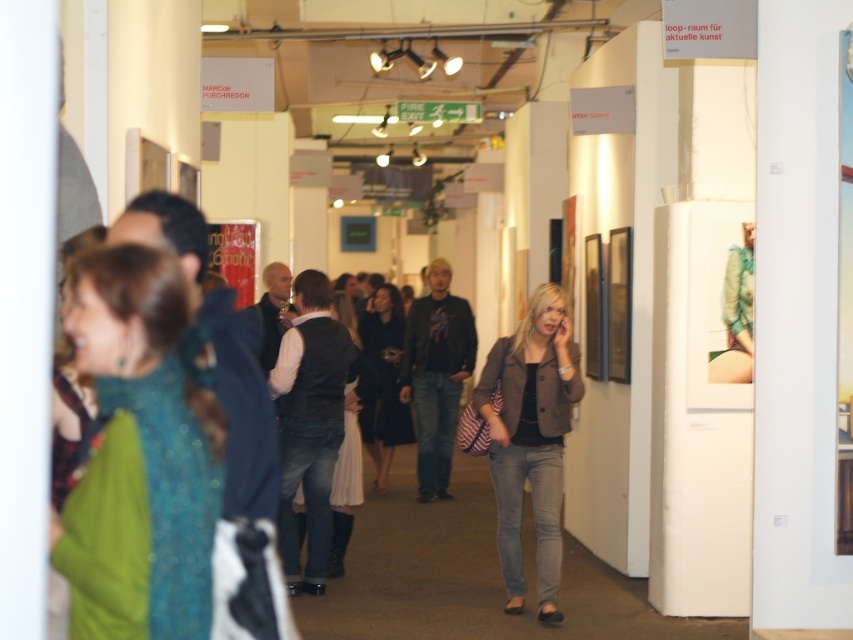
You are standing in the art gallery and want to take a photo of the matte brown blazer at center without any people blocking it. Where should you position yourself relative to the blazer?

Since the matte brown blazer at center is located at point 0.686 on the x and 0.623 on the y coordinates, you should position yourself in an area where there are no people obstructing the view, possibly to the left or right side of the corridor where the crowd is less dense, ensuring a clear shot.

You are an artist preparing to display a new sculpture that requires a 3 square feet space. You see the green sequined dress at left and the matte brown blazer at center in the gallery. Which of these two items has enough space for your sculpture?

The matte brown blazer at center has enough space for the sculpture since it occupies more space than the green sequined dress at left, which is too small.

You are an art gallery visitor standing at the entrance of the corridor. You notice the green sequined dress at left and the black dress at center. Which dress is positioned closer to you?

The green sequined dress at left is closer to the viewer than the black dress at center.